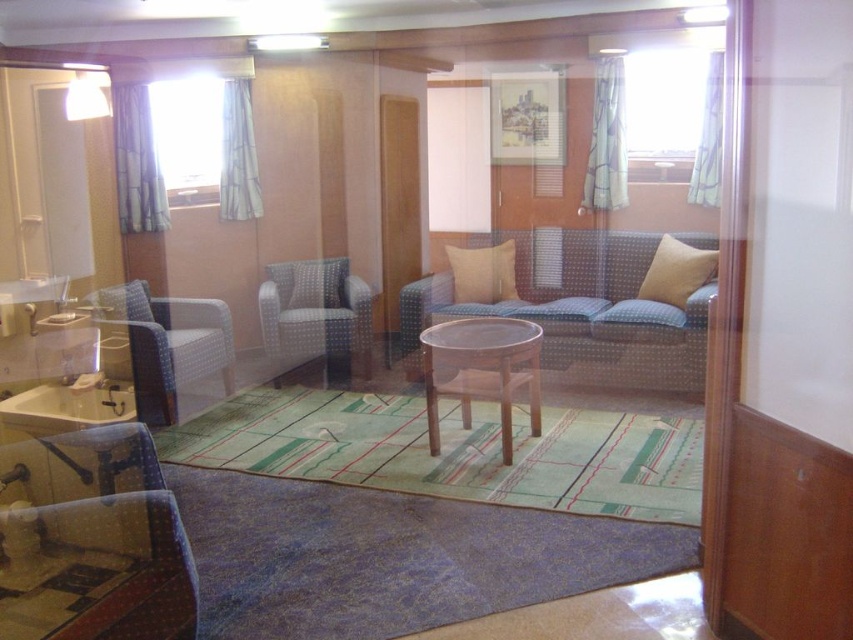
Question: Is matte blue armchair at left wider than white glossy sink at lower left?

Choices:
 (A) yes
 (B) no

Answer: (A)

Question: Can you confirm if matte blue armchair at left is positioned to the right of white glossy sink at lower left?

Choices:
 (A) no
 (B) yes

Answer: (B)

Question: Is matte blue armchair at left below beige fabric pillow at right?

Choices:
 (A) yes
 (B) no

Answer: (A)

Question: Which is farther from the light beige textured pillow at center?

Choices:
 (A) beige fabric pillow at right
 (B) brown wooden table at center
 (C) matte blue armchair at left

Answer: (A)

Question: Which of the following is the closest to the observer?

Choices:
 (A) matte blue armchair at center
 (B) light beige textured pillow at center
 (C) beige fabric pillow at center

Answer: (A)

Question: Which point is closer to the camera?

Choices:
 (A) (194, 364)
 (B) (502, 259)
 (C) (535, 364)

Answer: (C)